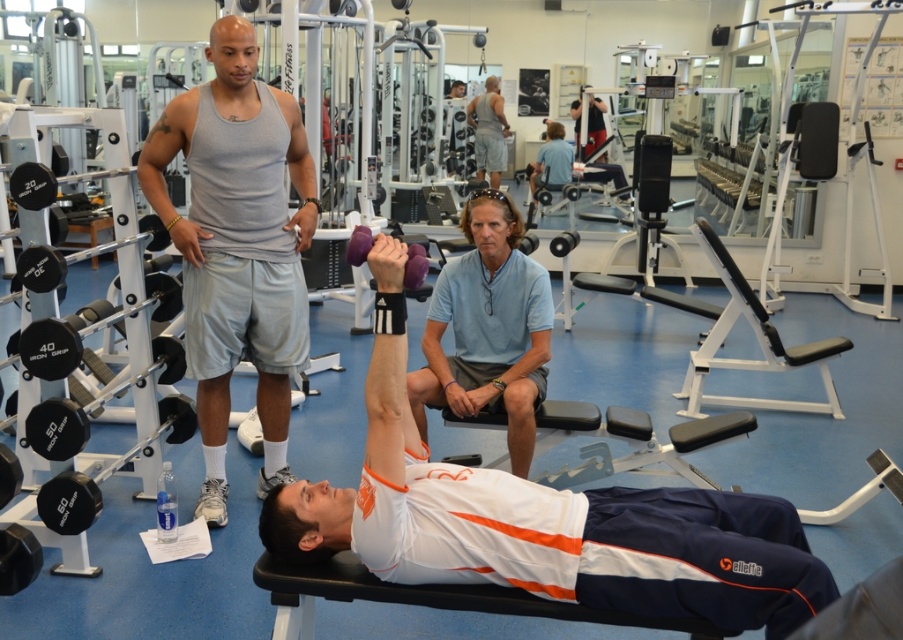
Is matte gray tank top at upper center shorter than matte black dumbbell at upper center?

No, matte gray tank top at upper center is not shorter than matte black dumbbell at upper center.

Is point (482, 116) less distant than point (589, 125)?

No, (482, 116) is further to viewer.

This screenshot has width=903, height=640. I want to click on matte gray tank top at upper center, so click(489, 131).

Is light blue cotton polo shirt at center closer to the viewer compared to matte gray tank top at upper center?

Yes.

Is light blue cotton polo shirt at center above matte gray tank top at upper center?

Incorrect, light blue cotton polo shirt at center is not positioned above matte gray tank top at upper center.

In order to click on light blue cotton polo shirt at center in this screenshot , I will do `click(489, 330)`.

Which is more to the left, white matte dumbbell at center or matte black dumbbell at upper center?

white matte dumbbell at center is more to the left.

Is the position of white matte dumbbell at center less distant than that of matte black dumbbell at upper center?

Yes.

Locate an element on the screen. white matte dumbbell at center is located at coordinates tap(541, 520).